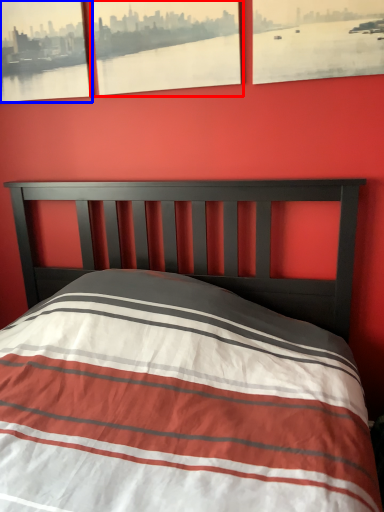
Question: Among these objects, which one is nearest to the camera, picture frame (highlighted by a red box) or picture frame (highlighted by a blue box)?

Choices:
 (A) picture frame
 (B) picture frame

Answer: (A)